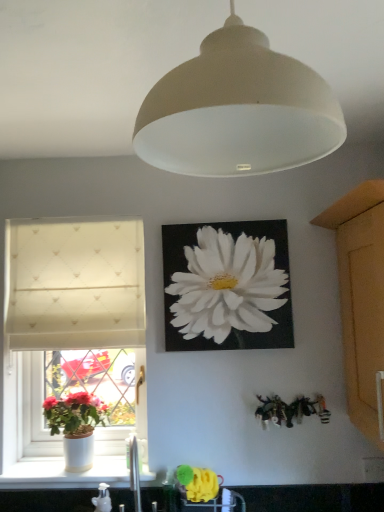
Question: Is wooden cabinet at right looking in the opposite direction of white matte lampshade at center?

Choices:
 (A) yes
 (B) no

Answer: (B)

Question: Is white matte lampshade at center located within wooden cabinet at right?

Choices:
 (A) no
 (B) yes

Answer: (A)

Question: Considering the relative sizes of wooden cabinet at right and white matte lampshade at center in the image provided, is wooden cabinet at right smaller than white matte lampshade at center?

Choices:
 (A) yes
 (B) no

Answer: (B)

Question: Does wooden cabinet at right turn towards white matte lampshade at center?

Choices:
 (A) yes
 (B) no

Answer: (B)

Question: Is wooden cabinet at right positioned far away from white matte lampshade at center?

Choices:
 (A) yes
 (B) no

Answer: (B)

Question: Is wooden cabinet at right wider than white matte lampshade at center?

Choices:
 (A) no
 (B) yes

Answer: (B)

Question: Does wooden cabinet at right appear on the right side of white glossy sink at lower center?

Choices:
 (A) yes
 (B) no

Answer: (A)

Question: From a real-world perspective, is wooden cabinet at right positioned over white glossy sink at lower center based on gravity?

Choices:
 (A) yes
 (B) no

Answer: (A)

Question: From the image's perspective, would you say wooden cabinet at right is positioned over white glossy sink at lower center?

Choices:
 (A) yes
 (B) no

Answer: (A)

Question: Considering the relative sizes of wooden cabinet at right and white glossy sink at lower center in the image provided, is wooden cabinet at right bigger than white glossy sink at lower center?

Choices:
 (A) no
 (B) yes

Answer: (B)

Question: Could you tell me if wooden cabinet at right is facing white glossy sink at lower center?

Choices:
 (A) yes
 (B) no

Answer: (A)

Question: Is white glossy sink at lower center surrounded by wooden cabinet at right?

Choices:
 (A) no
 (B) yes

Answer: (A)

Question: Does white fabric window at left have a smaller size compared to white textured curtain at left?

Choices:
 (A) no
 (B) yes

Answer: (A)